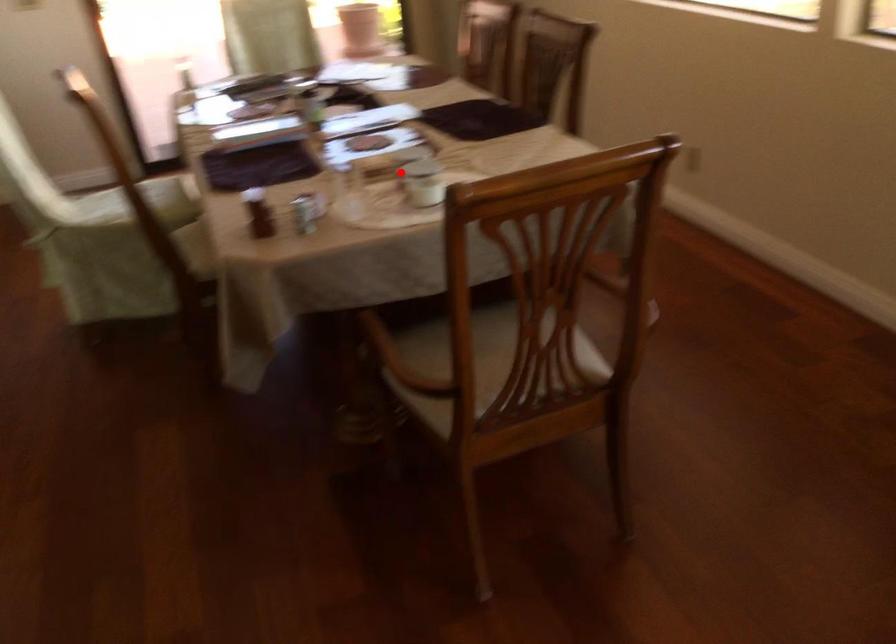
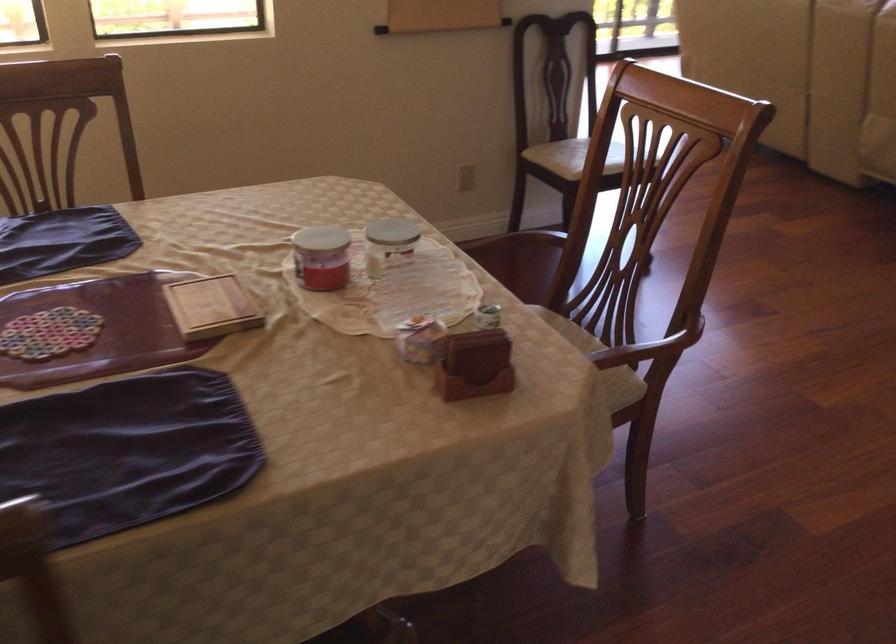
Where in the second image is the point corresponding to the highlighted location from the first image?

(389, 243)